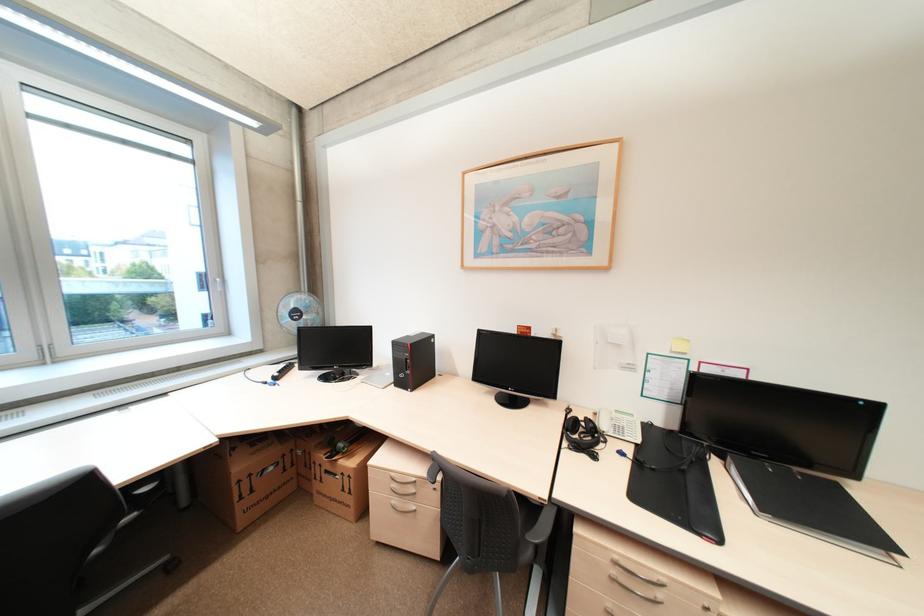
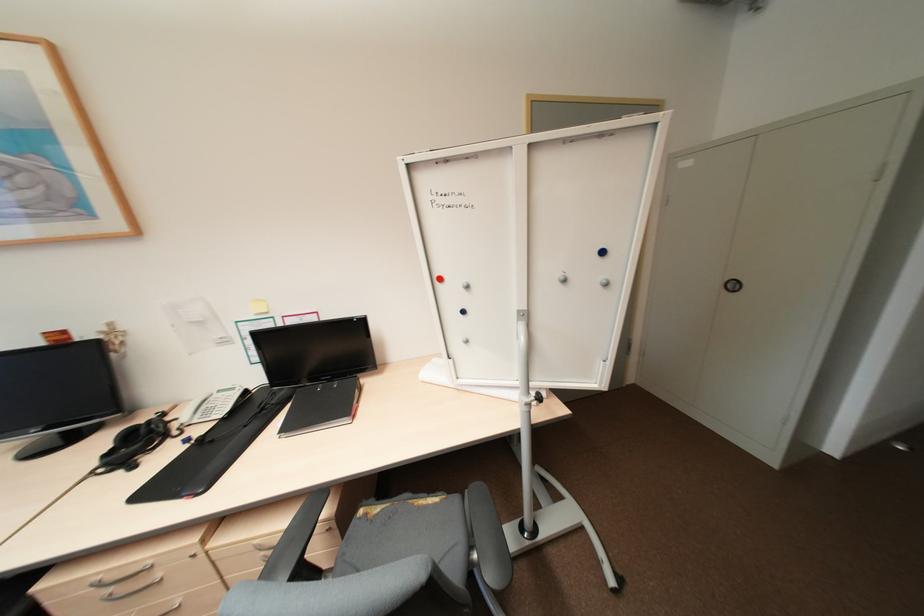
Find the pixel in the second image that matches point (622, 562) in the first image.

(104, 584)